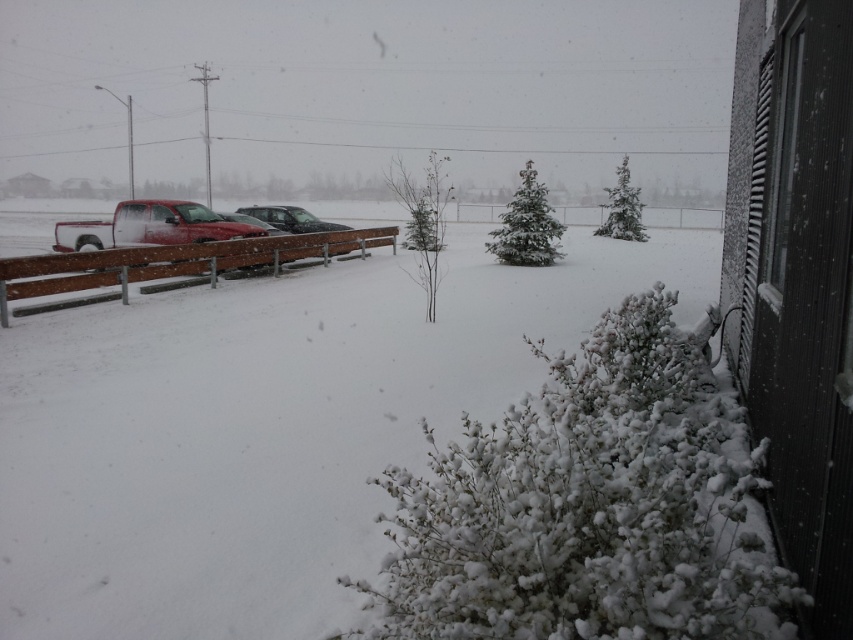
Which is in front, point (83, 230) or point (281, 227)?

Point (83, 230) is in front.

Which is more to the left, matte red truck at left or sleek silver sedan at center?

From the viewer's perspective, matte red truck at left appears more on the left side.

What do you see at coordinates (151, 227) in the screenshot? The width and height of the screenshot is (853, 640). I see `matte red truck at left` at bounding box center [151, 227].

Image resolution: width=853 pixels, height=640 pixels. In order to click on matte red truck at left in this screenshot , I will do `click(151, 227)`.